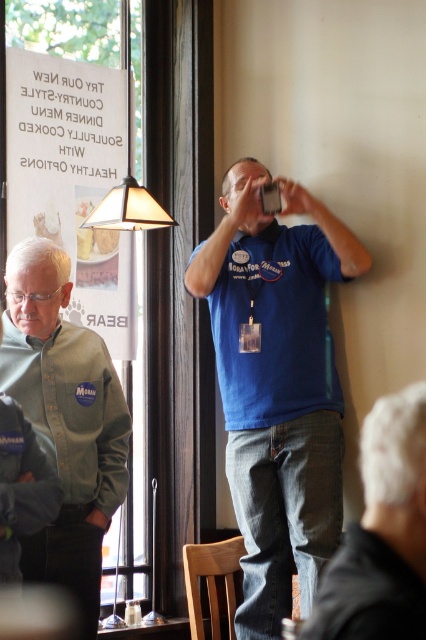
You are a photographer trying to capture the blue cotton shirt at center and the blue denim jeans at lower center in a single frame. Based on their positions, can you include both in the shot without moving the camera?

Yes, the blue cotton shirt at center is located above the blue denim jeans at lower center, so they are vertically aligned and can be captured in a single frame without moving the camera.

You are a photographer trying to capture the white paper sign at upper left and the blue cotton shirt at center in a single shot. Given that your camera has a limited field of view, which object should you position closer to the center of the frame to ensure both are visible?

Since the white paper sign at upper left is larger than the blue cotton shirt at center, you should position the smaller blue cotton shirt at center closer to the center of the frame to ensure both are visible within the limited field of view.